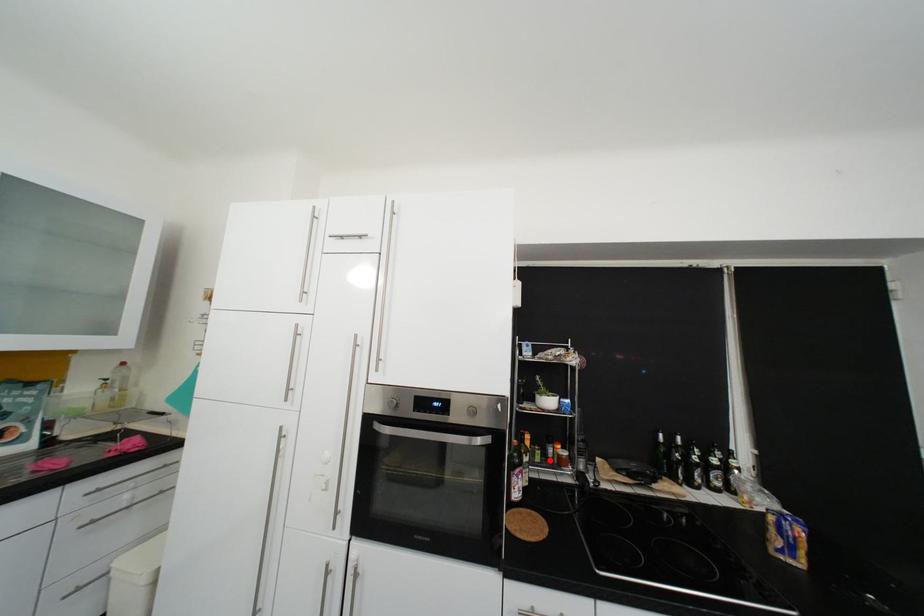
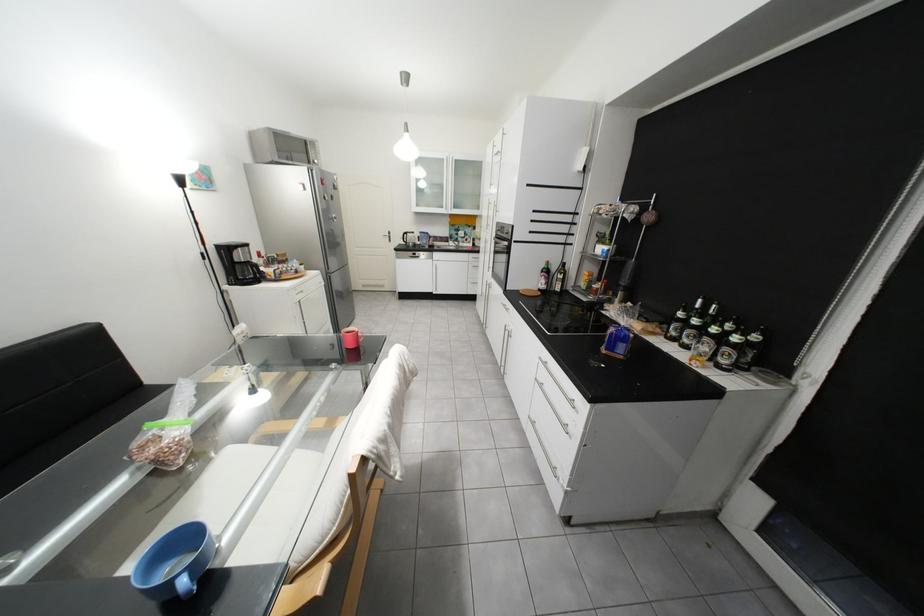
Locate, in the second image, the point that corresponds to the highlighted location in the first image.

(596, 288)